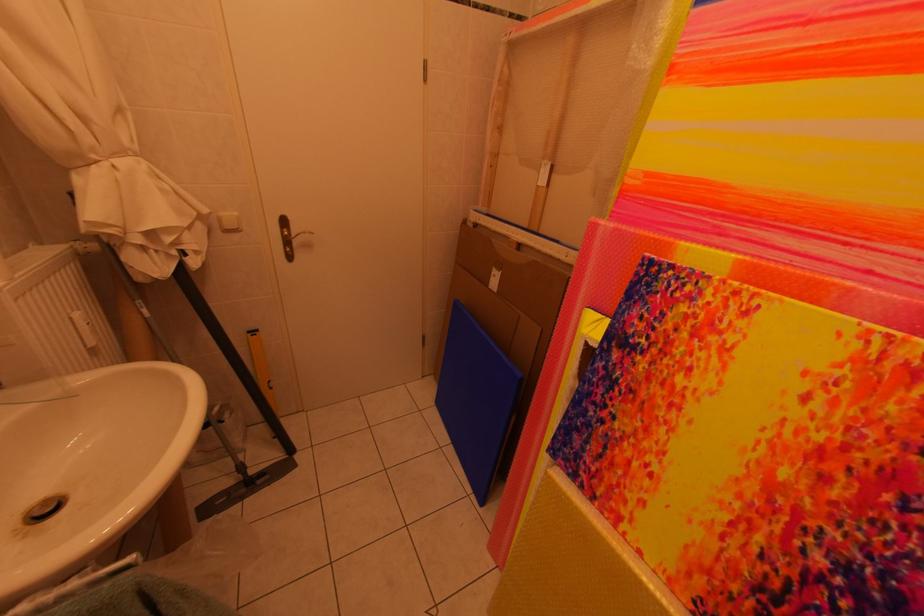
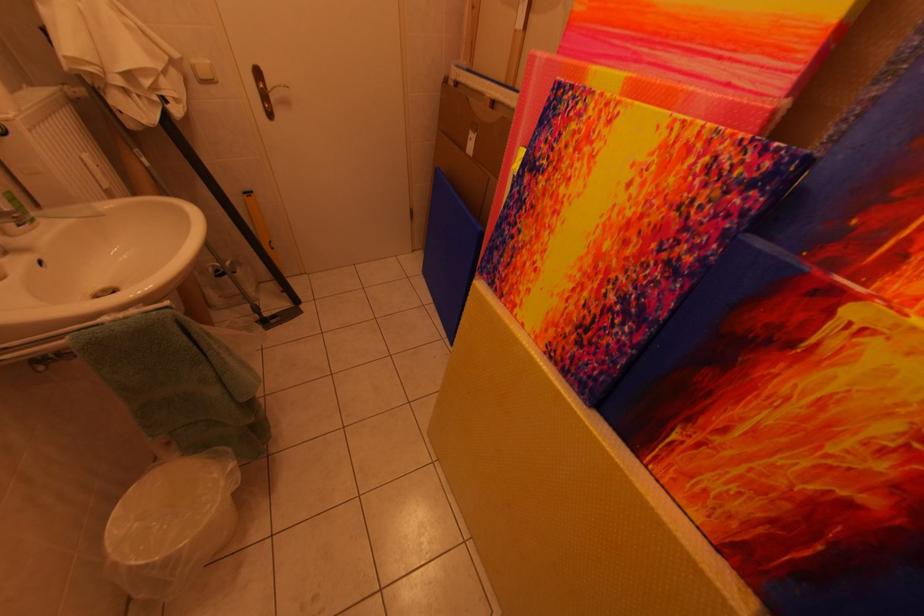
Find the pixel in the second image that matches (229,217) in the first image.

(203, 65)